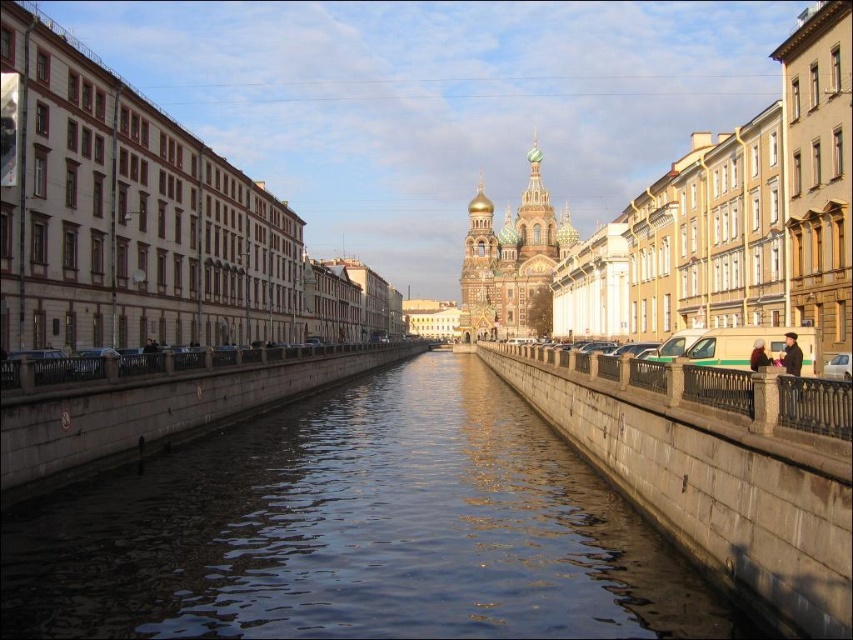
Does gold domed cathedral at center appear on the right side of light brown leather jacket at right?

No, gold domed cathedral at center is not to the right of light brown leather jacket at right.

Which is below, gold domed cathedral at center or light brown leather jacket at right?

light brown leather jacket at right

I want to click on gold domed cathedral at center, so click(x=509, y=259).

Identify the location of gold domed cathedral at center. (509, 259).

Who is taller, smooth concrete water at center or light brown leather jacket at right?

With more height is smooth concrete water at center.

Consider the image. Measure the distance between smooth concrete water at center and camera.

51.81 meters

Who is more distant from viewer, (292, 508) or (759, 362)?

The point (292, 508) is more distant.

Identify the location of smooth concrete water at center. (358, 531).

Consider the image. Which is below, smooth concrete water at center or gold domed cathedral at center?

smooth concrete water at center is below.

Is smooth concrete water at center taller than gold domed cathedral at center?

No.

Does point (566, 461) come closer to viewer compared to point (495, 300)?

That is True.

You are a GUI agent. You are given a task and a screenshot of the screen. Output one action in this format:
    pyautogui.click(x=<x>, y=<y>)
    Task: Click on the smooth concrete water at center
    The image size is (853, 640).
    Given the screenshot: What is the action you would take?
    click(358, 531)